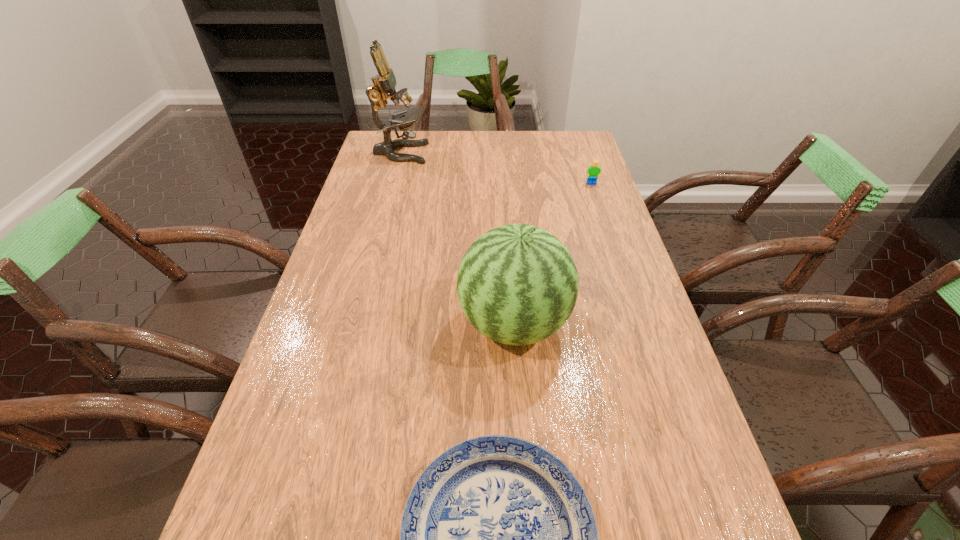
The height and width of the screenshot is (540, 960). What are the coordinates of `free area in between the farthest object and the third nearest object` in the screenshot? It's located at (496, 168).

Identify which object is located as the nearest to the leftmost object. Please provide its 2D coordinates. Your answer should be formatted as a tuple, i.e. [(x, y)], where the tuple contains the x and y coordinates of a point satisfying the conditions above.

[(593, 171)]

Select which object is the second closest to the microscope. Please provide its 2D coordinates. Your answer should be formatted as a tuple, i.e. [(x, y)], where the tuple contains the x and y coordinates of a point satisfying the conditions above.

[(517, 284)]

Locate an element on the screen. This screenshot has width=960, height=540. free space that satisfies the following two spatial constraints: 1. at the eyepieces of the leftmost object; 2. on the right side of the second tallest object is located at coordinates (355, 323).